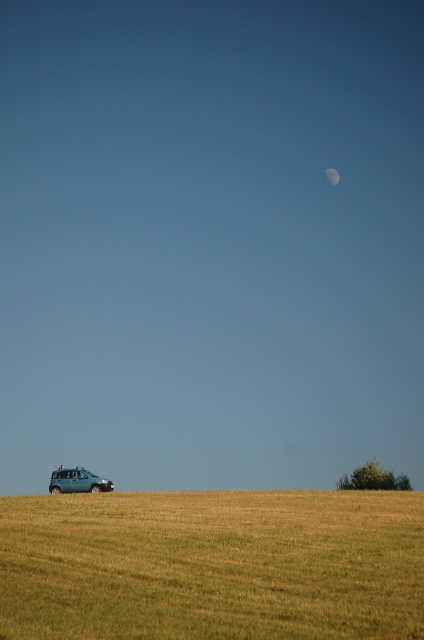
Who is more distant from viewer, (27, 621) or (335, 172)?

Point (335, 172)

Can you confirm if golden dry grass at lower center is positioned above gray/white textured moon at upper center?

Actually, golden dry grass at lower center is below gray/white textured moon at upper center.

Locate an element on the screen. golden dry grass at lower center is located at coordinates (212, 564).

Is teal matte car at lower left thinner than gray/white textured moon at upper center?

Incorrect, teal matte car at lower left's width is not less than gray/white textured moon at upper center's.

Which is more to the left, teal matte car at lower left or gray/white textured moon at upper center?

teal matte car at lower left is more to the left.

Between point (83, 492) and point (337, 180), which one is positioned behind?

Point (337, 180)

Image resolution: width=424 pixels, height=640 pixels. I want to click on teal matte car at lower left, so click(x=77, y=481).

Between golden dry grass at lower center and teal matte car at lower left, which one has more height?

With more height is teal matte car at lower left.

Between golden dry grass at lower center and teal matte car at lower left, which one is positioned higher?

golden dry grass at lower center is higher up.

Which is behind, point (387, 630) or point (81, 484)?

Point (81, 484)

Find the location of a particular element. The width and height of the screenshot is (424, 640). golden dry grass at lower center is located at coordinates (212, 564).